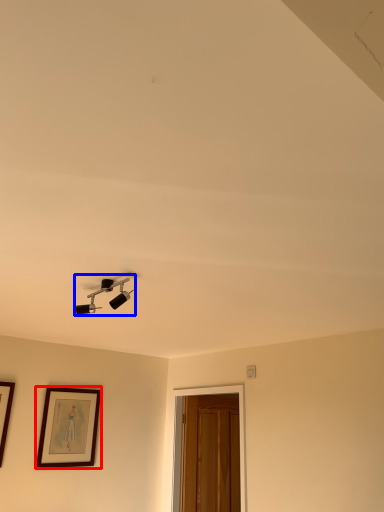
Question: Which object is further to the camera taking this photo, picture frame (highlighted by a red box) or lamp (highlighted by a blue box)?

Choices:
 (A) picture frame
 (B) lamp

Answer: (A)